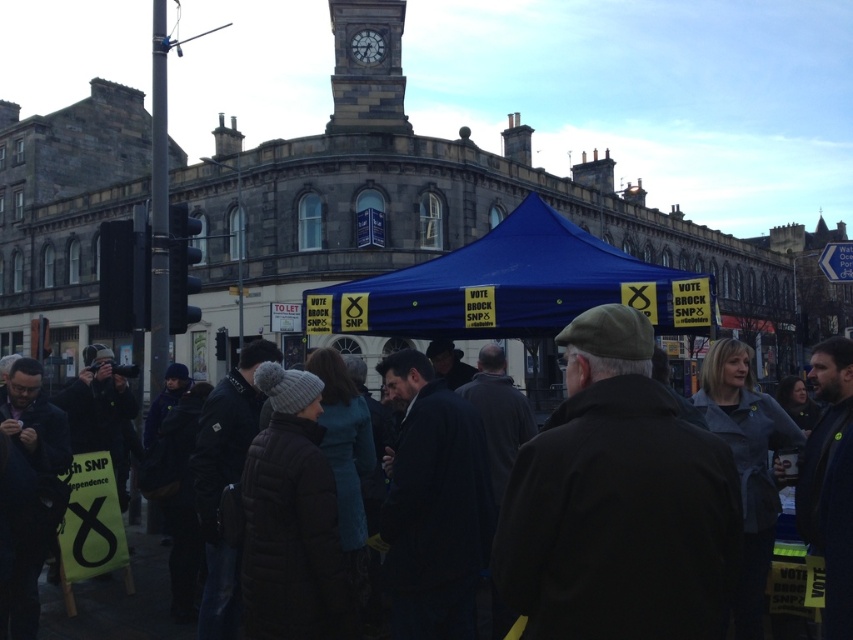
Question: Which object appears farthest from the camera in this image?

Choices:
 (A) stone clock tower at upper center
 (B) blue fabric canopy at center
 (C) dark gray wool coat at center
 (D) dark brown woolen coat at center

Answer: (A)

Question: Does blue fabric canopy at center come in front of dark gray wool coat at center?

Choices:
 (A) no
 (B) yes

Answer: (A)

Question: Which point is farther from the camera taking this photo?

Choices:
 (A) (355, 48)
 (B) (634, 305)
 (C) (375, 100)

Answer: (A)

Question: Which object is positioned farthest from the stone clock tower at upper center?

Choices:
 (A) dark brown woolen coat at center
 (B) dark gray stone clock at upper center
 (C) blue fabric canopy at center
 (D) dark gray wool coat at center

Answer: (A)

Question: Does dark brown woolen coat at center have a smaller size compared to dark gray stone clock at upper center?

Choices:
 (A) no
 (B) yes

Answer: (A)

Question: Is dark brown woolen coat at center behind blue fabric canopy at center?

Choices:
 (A) no
 (B) yes

Answer: (A)